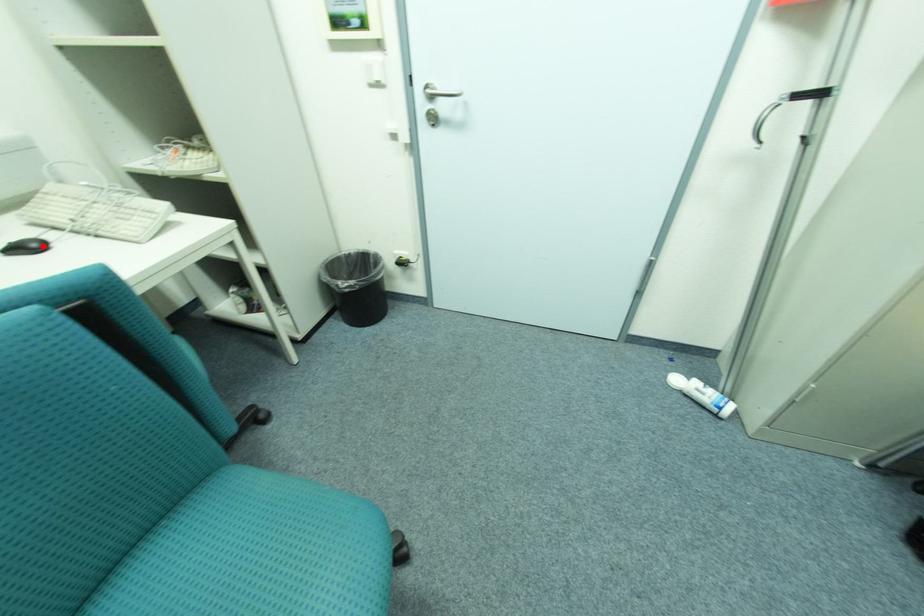
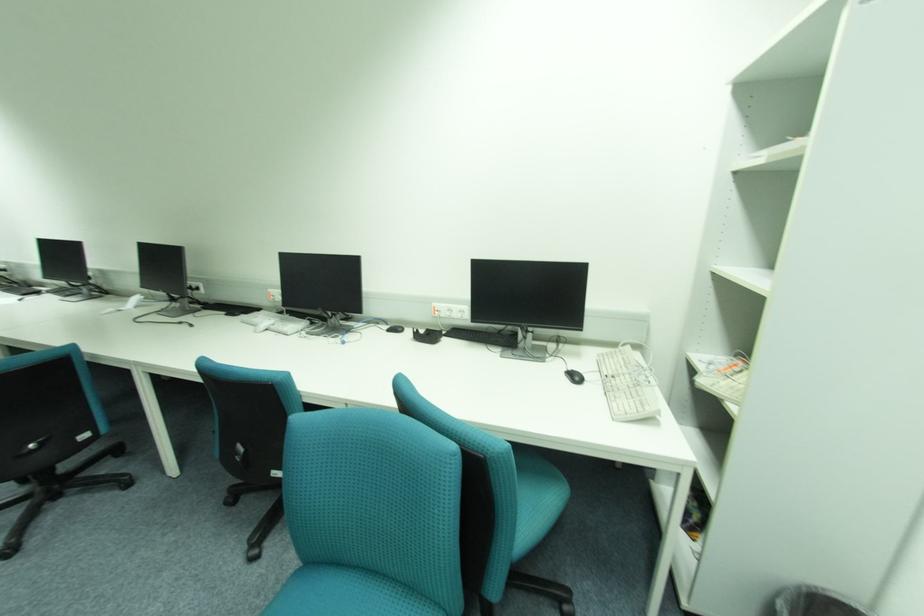
The point at the highlighted location is marked in the first image. Where is the corresponding point in the second image?

(584, 379)